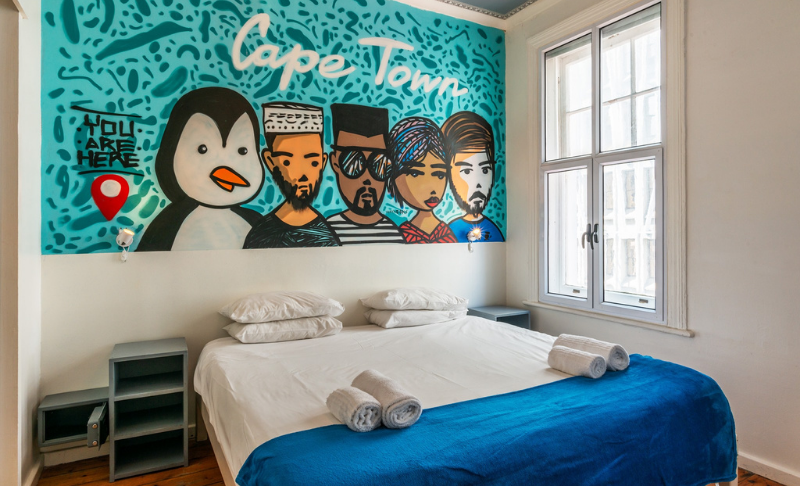
Image resolution: width=800 pixels, height=486 pixels. Identify the location of towel. (398, 397).